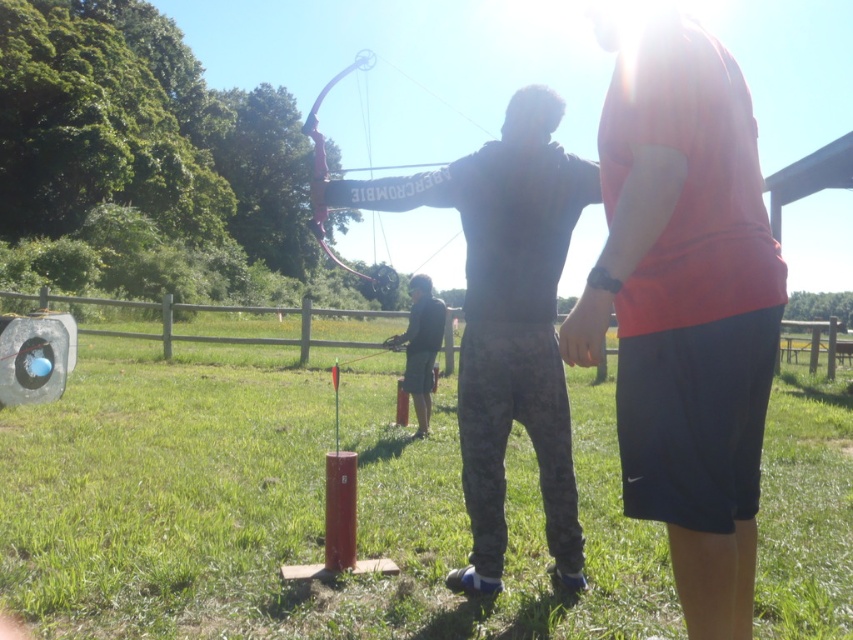
You are an archer preparing to shoot an arrow. You see the orange fabric shirt at upper right and the pink matte bow at center. Which object is located to the right of the other?

The orange fabric shirt at upper right is to the right of the pink matte bow at center.

You are an archery instructor observing the scene. You need to determine which object is smaller between the camouflage pants at center and the pink matte bow at center. Which one is smaller?

The camouflage pants at center is smaller than the pink matte bow at center according to the description.

You are an archery instructor observing the scene. You need to determine which object takes up more area in the image between the matte black hoodie at center and the pink matte bow at center. Which one is it?

The pink matte bow at center takes up more area in the image because the matte black hoodie at center occupies less space than the pink matte bow at center.